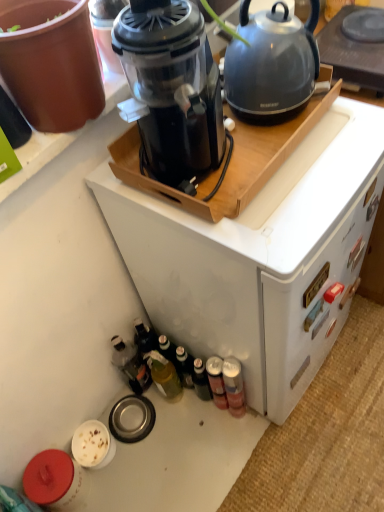
Find the location of `free spot above matte gray kettle at upper right (from a real-world perspective)`. free spot above matte gray kettle at upper right (from a real-world perspective) is located at coordinates (358, 28).